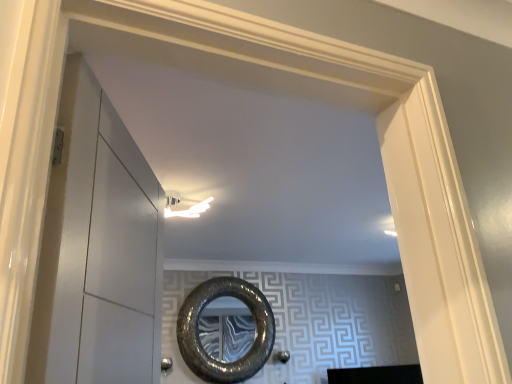
Question: In terms of size, does polished silver door handle at lower center appear bigger or smaller than transparent glass door at left?

Choices:
 (A) small
 (B) big

Answer: (A)

Question: In terms of width, does polished silver door handle at lower center look wider or thinner when compared to transparent glass door at left?

Choices:
 (A) wide
 (B) thin

Answer: (B)

Question: Based on their relative distances, which object is farther from the polished silver door handle at lower center?

Choices:
 (A) shiny metallic mirror at center
 (B) transparent glass door at left

Answer: (B)

Question: Which is nearer to the transparent glass door at left?

Choices:
 (A) polished silver door handle at lower center
 (B) shiny metallic mirror at center

Answer: (B)